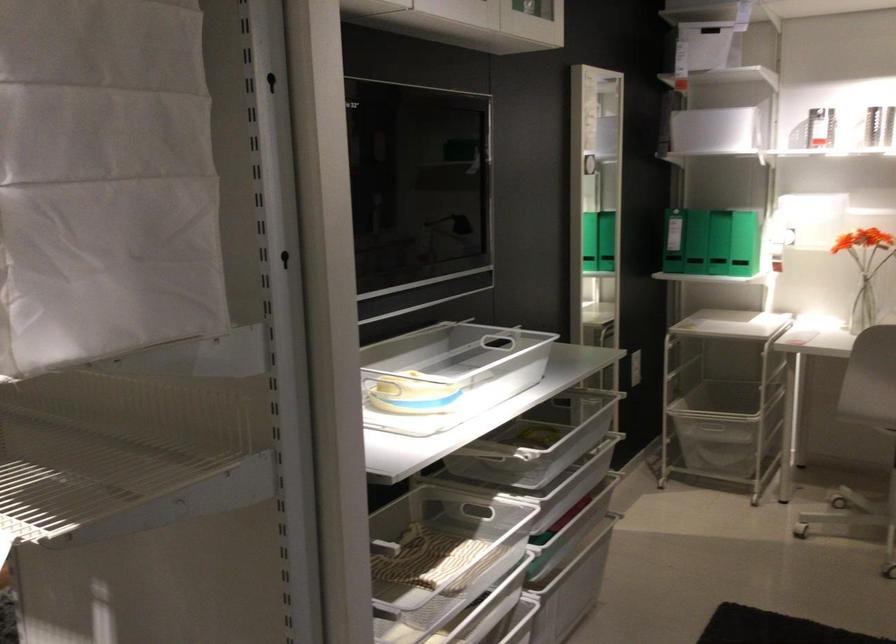
Identify the location of white bin handle. This screenshot has width=896, height=644. (712, 430).